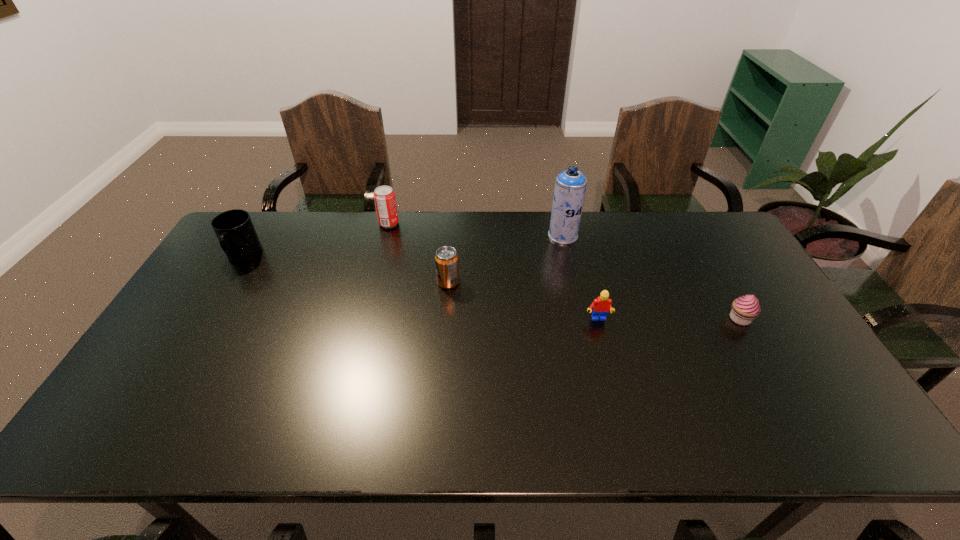
Image resolution: width=960 pixels, height=540 pixels. What are the coordinates of `free space located 0.260m on the side of the leftmost object with the handle` in the screenshot? It's located at (195, 335).

Find the location of a particular element. The width and height of the screenshot is (960, 540). vacant region located 0.090m on the right of the third object from left to right is located at coordinates (489, 282).

Identify the location of free space located on the front-facing side of the Lego. The height and width of the screenshot is (540, 960). (630, 445).

This screenshot has width=960, height=540. I want to click on free region located on the back of the rightmost object, so click(x=705, y=258).

Find the location of a particular element. aerosol can present at the far edge is located at coordinates (570, 186).

Where is `soda can located at the far edge`? This screenshot has width=960, height=540. soda can located at the far edge is located at coordinates (384, 197).

The width and height of the screenshot is (960, 540). Find the location of `mug situated at the far edge`. mug situated at the far edge is located at coordinates (234, 229).

Find the location of `object that is at the left edge`. object that is at the left edge is located at coordinates (234, 229).

Find the location of a particular element. The width and height of the screenshot is (960, 540). object present at the right edge is located at coordinates (744, 309).

Where is `object at the far left corner`? object at the far left corner is located at coordinates (234, 229).